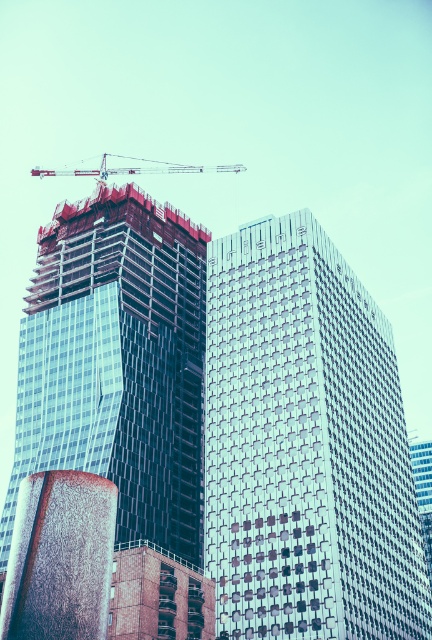
You are standing in the urban landscape and want to take a photo of the glassy reflective building at center. If your camera has a maximum zoom range of 60 meters, will you be able to capture the building clearly without moving closer?

The glassy reflective building at center is 59.10 meters away from the viewer. Since the camera can zoom up to 60 meters, you can capture the building clearly without moving closer.

You are a city planner reviewing the urban layout. You need to determine the order of visibility for the two structures. Which building, the glassy reflective building at center or the white metallic crane at upper center, would appear closer to an observer standing at the base of the buildings?

The glassy reflective building at center is closer to the viewer than the white metallic crane at upper center, so it would appear closer to an observer standing at the base of the buildings.